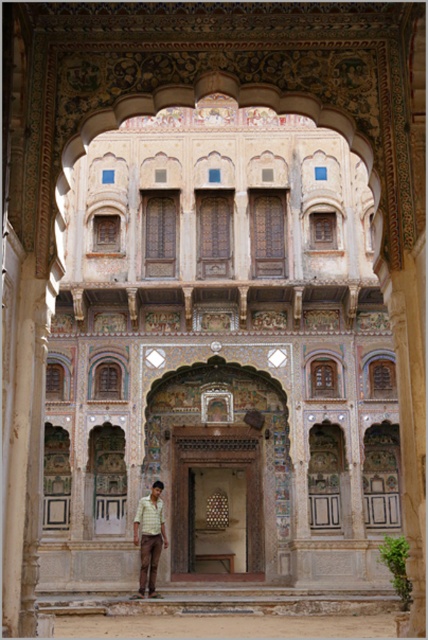
You are standing in front of the grand architectural structure and notice two shirts in the scene. Which shirt, the checkered shirt at center or the yellow checkered shirt at lower center, is closer to you?

The checkered shirt at center is closer to you because the yellow checkered shirt at lower center is behind it.

Where is the checkered shirt at center located in the image?

The checkered shirt at center is located at point 0.842 on the x axis and 0.350 on the y axis.